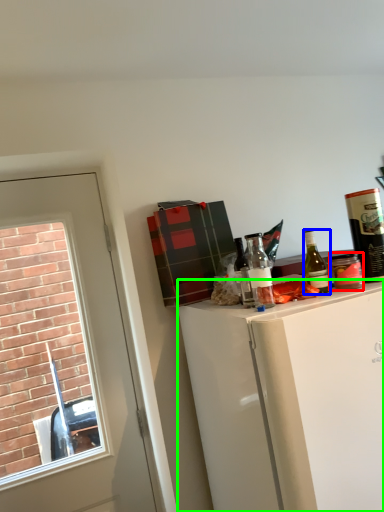
Question: Estimate the real-world distances between objects in this image. Which object is farther from beverage (highlighted by a red box), bottle (highlighted by a blue box) or cabinetry (highlighted by a green box)?

Choices:
 (A) bottle
 (B) cabinetry

Answer: (B)